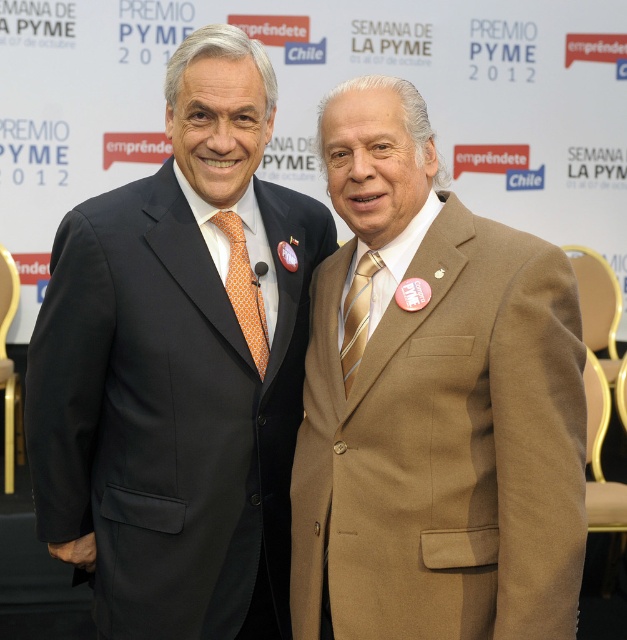
Is matte black suit at center shorter than tan wool suit at center?

In fact, matte black suit at center may be taller than tan wool suit at center.

The width and height of the screenshot is (627, 640). What do you see at coordinates (179, 365) in the screenshot?
I see `matte black suit at center` at bounding box center [179, 365].

Between point (97, 385) and point (487, 308), which one is positioned behind?

The point (97, 385) is more distant.

The height and width of the screenshot is (640, 627). Identify the location of matte black suit at center. (179, 365).

Is point (327, 221) farther from camera compared to point (241, 252)?

Yes, it is behind point (241, 252).

Locate an element on the screen. The width and height of the screenshot is (627, 640). matte black suit at center is located at coordinates (179, 365).

Image resolution: width=627 pixels, height=640 pixels. In order to click on matte black suit at center in this screenshot , I will do `click(179, 365)`.

Does point (240, 241) come closer to viewer compared to point (349, 321)?

No, (240, 241) is further to viewer.

Is point (256, 348) more distant than point (345, 348)?

That is True.

The height and width of the screenshot is (640, 627). Identify the location of orange dotted tie at center. (245, 289).